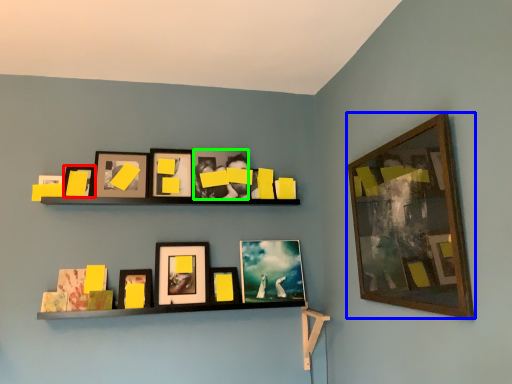
Question: Based on their relative distances, which object is nearer to picture frame (highlighted by a red box)? Choose from picture frame (highlighted by a blue box) and picture frame (highlighted by a green box).

Choices:
 (A) picture frame
 (B) picture frame

Answer: (B)